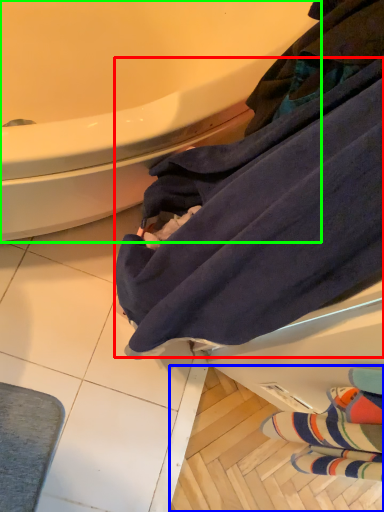
Question: Based on their relative distances, which object is nearer to bath towel (highlighted by a red box)? Choose from tile (highlighted by a blue box) and bathtub (highlighted by a green box).

Choices:
 (A) tile
 (B) bathtub

Answer: (B)